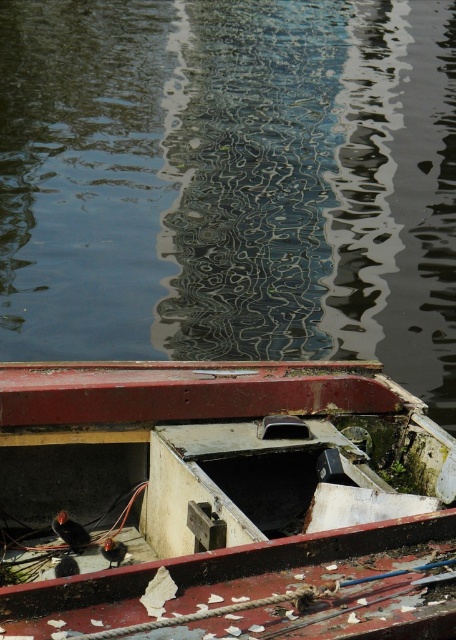
Question: Is smooth water at center below rusty metal boat at lower center?

Choices:
 (A) yes
 (B) no

Answer: (B)

Question: Is smooth water at center to the right of rusty metal boat at lower center from the viewer's perspective?

Choices:
 (A) no
 (B) yes

Answer: (A)

Question: Can you confirm if smooth water at center is positioned above rusty metal boat at lower center?

Choices:
 (A) yes
 (B) no

Answer: (A)

Question: Which point is farther from the camera taking this photo?

Choices:
 (A) (229, 627)
 (B) (423, 243)

Answer: (B)